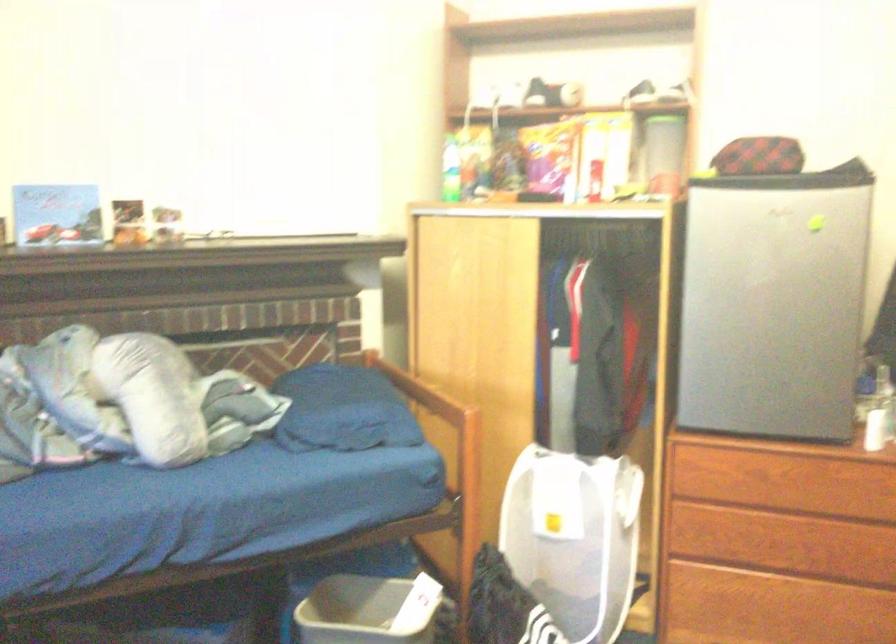
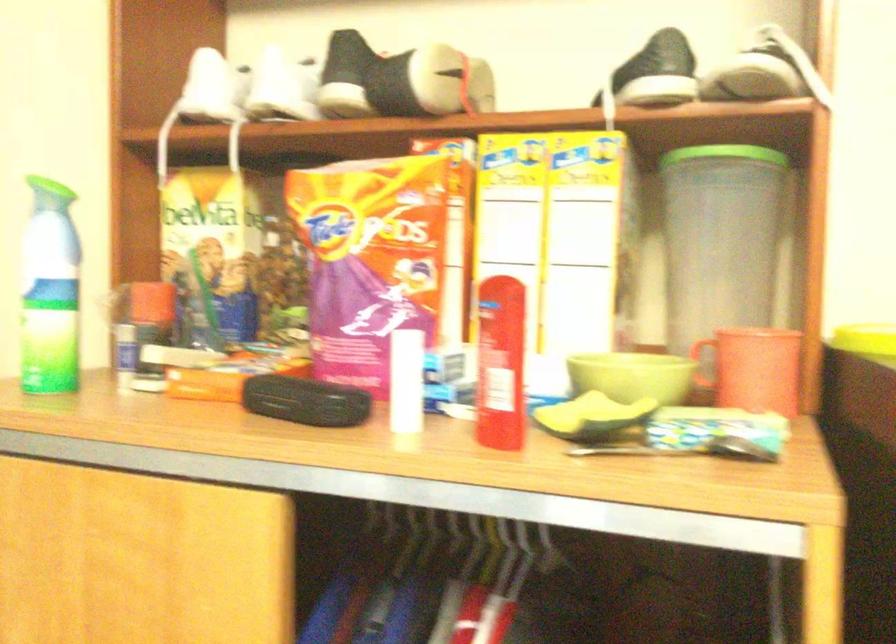
In the second image, find the point that corresponds to (664,116) in the first image.

(725, 153)